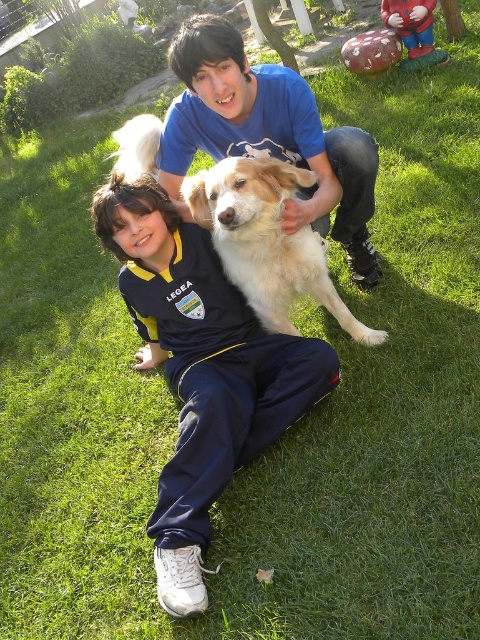
Question: Based on their relative distances, which object is nearer to the smooth blue shirt at center?

Choices:
 (A) dark blue track suit at center
 (B) golden fur dog at center

Answer: (B)

Question: Is dark blue track suit at center to the right of golden fur dog at center from the viewer's perspective?

Choices:
 (A) no
 (B) yes

Answer: (A)

Question: Which of the following is the farthest from the observer?

Choices:
 (A) golden fur dog at center
 (B) smooth blue shirt at center

Answer: (B)

Question: Is dark blue track suit at center behind smooth blue shirt at center?

Choices:
 (A) yes
 (B) no

Answer: (B)

Question: Which point appears farthest from the camera in this image?

Choices:
 (A) (241, 301)
 (B) (278, 202)

Answer: (A)

Question: From the image, what is the correct spatial relationship of smooth blue shirt at center in relation to golden fur dog at center?

Choices:
 (A) below
 (B) above

Answer: (B)